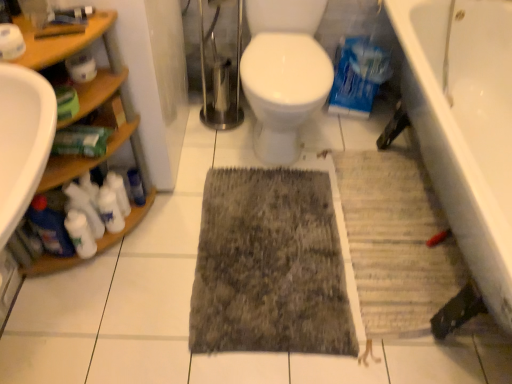
The width and height of the screenshot is (512, 384). I want to click on free spot above woodenshelves at left (from a real-world perspective), so click(46, 33).